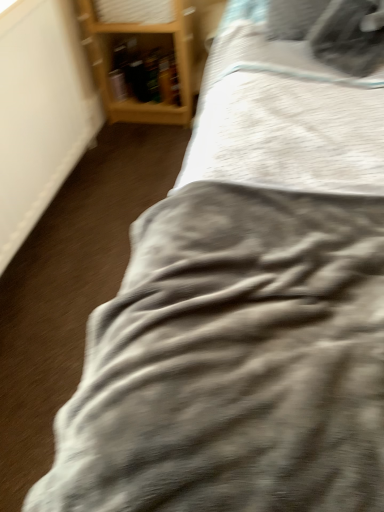
Describe the element at coordinates (143, 52) in the screenshot. The width and height of the screenshot is (384, 512). I see `wooden shelf at upper left` at that location.

Locate an element on the screen. wooden shelf at upper left is located at coordinates (143, 52).

In order to click on wooden shelf at upper left in this screenshot , I will do `click(143, 52)`.